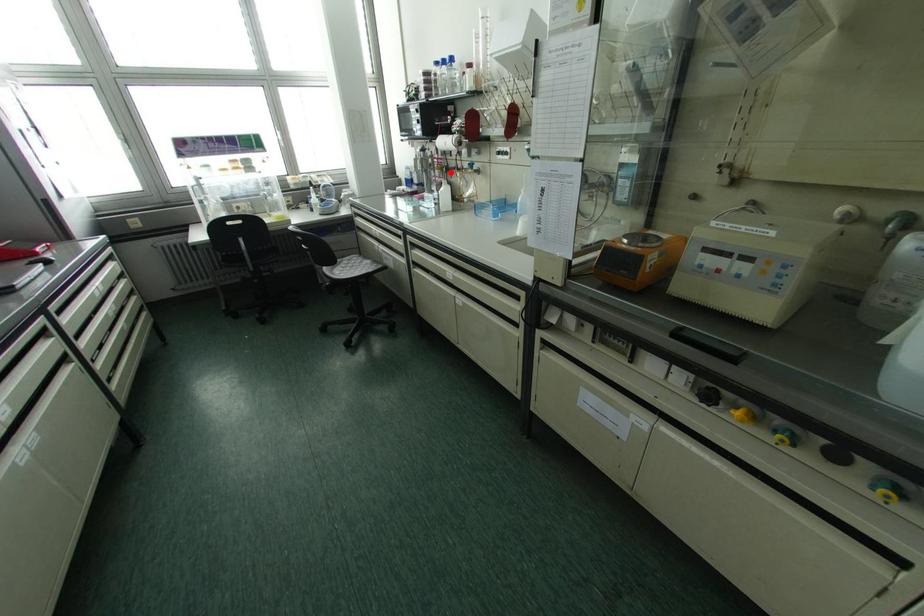
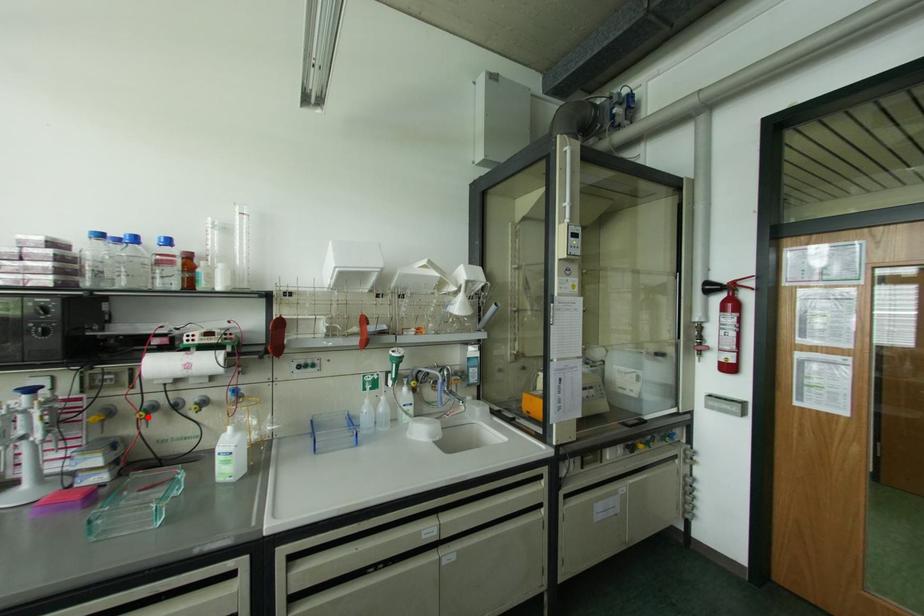
I am providing you with two images of the same scene from different viewpoints. A red point is marked on the first image and another point is marked on the second image. Is the red point in image1 aligned with the point shown in image2?

Yes